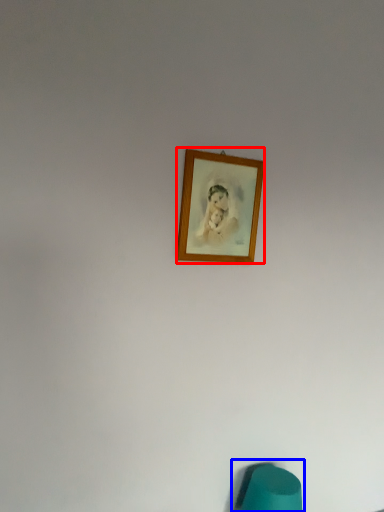
Question: Which of the following is the farthest to the observer, picture frame (highlighted by a red box) or bean bag chair (highlighted by a blue box)?

Choices:
 (A) picture frame
 (B) bean bag chair

Answer: (B)